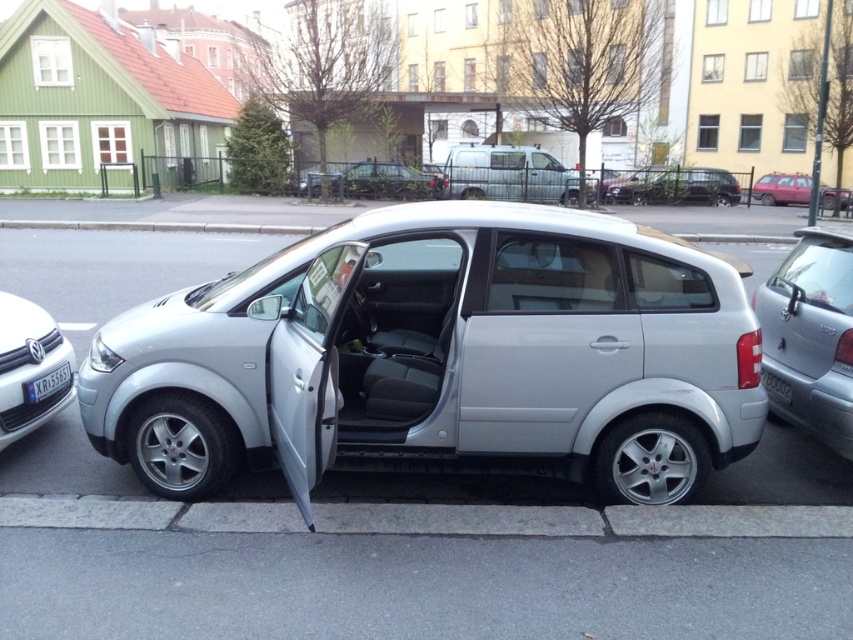
Question: Observing the image, what is the correct spatial positioning of white matte volkswagen at left in reference to black plastic license plate at lower left?

Choices:
 (A) above
 (B) below

Answer: (A)

Question: Does metallic silver suv at center appear on the left side of metallic silver hatchback at center?

Choices:
 (A) yes
 (B) no

Answer: (B)

Question: Which point is farther to the camera?

Choices:
 (A) silver metallic hatchback at center
 (B) satin silver door at center
 (C) satin silver hatchback at right

Answer: (C)

Question: Is metallic silver van at center thinner than metallic silver hatchback at center?

Choices:
 (A) no
 (B) yes

Answer: (A)

Question: Which object is farther from the camera taking this photo?

Choices:
 (A) metallic silver van at center
 (B) gray concrete curb at lower center
 (C) satin silver door at center
 (D) metallic silver suv at center

Answer: (D)

Question: Based on their relative distances, which object is nearer to the metallic silver van at center?

Choices:
 (A) white matte volkswagen at left
 (B) black plastic license plate at lower right
 (C) satin silver door at center

Answer: (B)